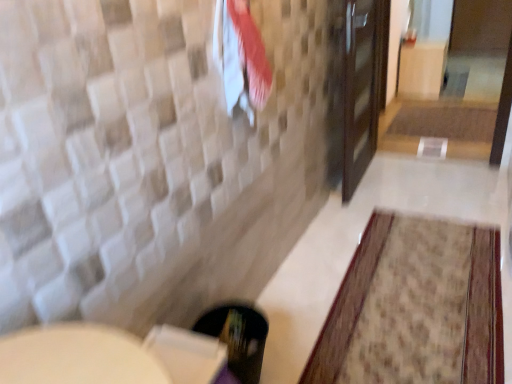
Question: From their relative heights in the image, would you say brown textured bath mat at center, the second bath mat in the bottom-to-top sequence, is taller or shorter than white cotton beach towel at upper center?

Choices:
 (A) short
 (B) tall

Answer: (A)

Question: From a real-world perspective, is brown textured bath mat at center, positioned as the 1th bath mat in top-to-bottom order, above or below white cotton beach towel at upper center?

Choices:
 (A) above
 (B) below

Answer: (B)

Question: Considering the real-world distances, which object is farthest from the white cotton beach towel at upper center?

Choices:
 (A) brown textured bath mat at center, the 1th bath mat from the back
 (B) beige textured rug at lower right, the second bath mat viewed from the right

Answer: (A)

Question: Estimate the real-world distances between objects in this image. Which object is farther from the white cotton beach towel at upper center?

Choices:
 (A) brown textured bath mat at center, the second bath mat in the bottom-to-top sequence
 (B) beige textured rug at lower right, the second bath mat positioned from the back

Answer: (A)